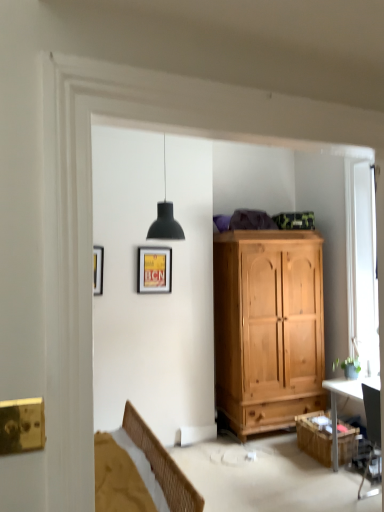
Question: Considering the relative sizes of wooden cabinet at lower right and matte yellow poster at upper center in the image provided, is wooden cabinet at lower right bigger than matte yellow poster at upper center?

Choices:
 (A) yes
 (B) no

Answer: (A)

Question: Is matte yellow poster at upper center at the back of wooden cabinet at lower right?

Choices:
 (A) no
 (B) yes

Answer: (A)

Question: Considering the relative positions of wooden cabinet at lower right and matte yellow poster at upper center in the image provided, is wooden cabinet at lower right to the right of matte yellow poster at upper center from the viewer's perspective?

Choices:
 (A) no
 (B) yes

Answer: (B)

Question: Considering the relative sizes of wooden cabinet at lower right and matte yellow poster at upper center in the image provided, is wooden cabinet at lower right smaller than matte yellow poster at upper center?

Choices:
 (A) yes
 (B) no

Answer: (B)

Question: Is the depth of wooden cabinet at lower right less than that of matte yellow poster at upper center?

Choices:
 (A) no
 (B) yes

Answer: (B)

Question: Is matte yellow poster at upper center surrounded by wooden cabinet at lower right?

Choices:
 (A) yes
 (B) no

Answer: (B)

Question: From a real-world perspective, is black glossy desk at right physically above matte yellow poster at upper center?

Choices:
 (A) yes
 (B) no

Answer: (B)

Question: Is black glossy desk at right oriented towards matte yellow poster at upper center?

Choices:
 (A) yes
 (B) no

Answer: (B)

Question: Is black glossy desk at right oriented away from matte yellow poster at upper center?

Choices:
 (A) yes
 (B) no

Answer: (B)

Question: Considering the relative sizes of black glossy desk at right and matte yellow poster at upper center in the image provided, is black glossy desk at right shorter than matte yellow poster at upper center?

Choices:
 (A) yes
 (B) no

Answer: (B)

Question: Considering the relative sizes of black glossy desk at right and matte yellow poster at upper center in the image provided, is black glossy desk at right thinner than matte yellow poster at upper center?

Choices:
 (A) no
 (B) yes

Answer: (A)

Question: Is black glossy desk at right positioned far away from matte yellow poster at upper center?

Choices:
 (A) no
 (B) yes

Answer: (B)

Question: Is white wooden window at right not within wooden cabinet at lower right?

Choices:
 (A) yes
 (B) no

Answer: (A)